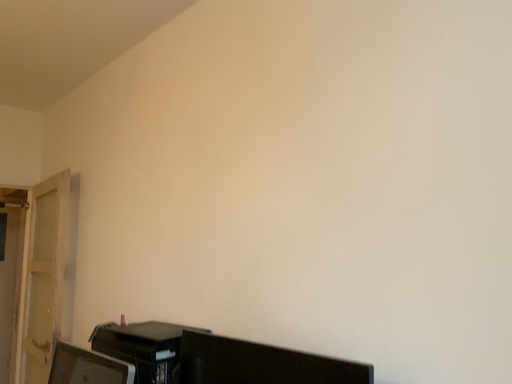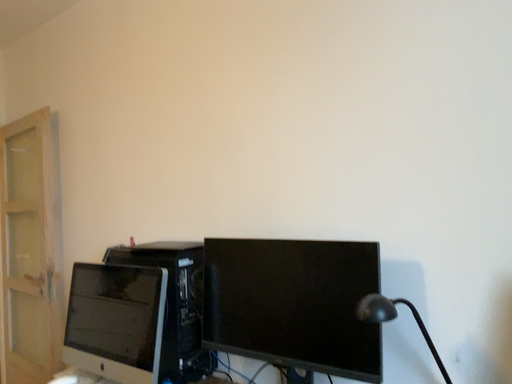
Question: How did the camera likely rotate when shooting the video?

Choices:
 (A) rotated upward
 (B) rotated downward

Answer: (B)